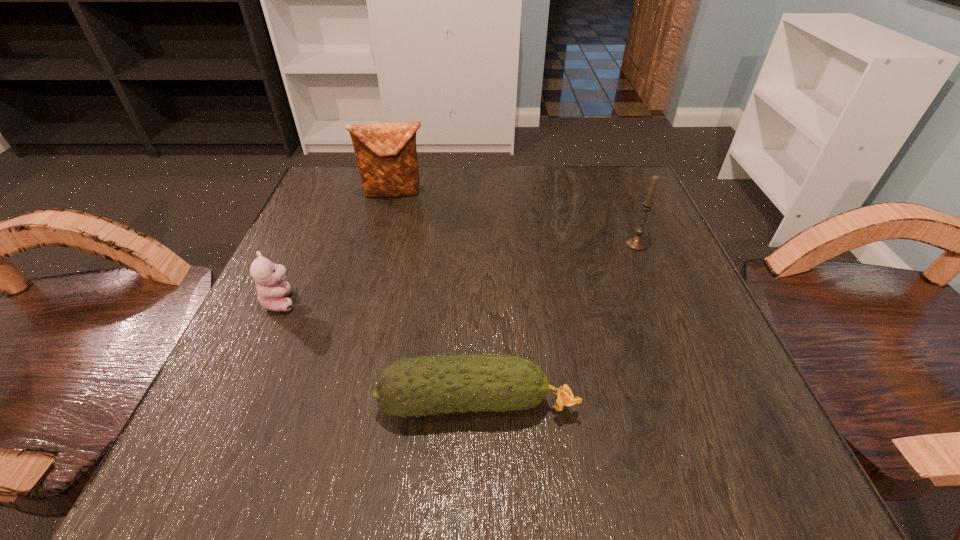
Image resolution: width=960 pixels, height=540 pixels. Find the location of `free space at the right edge`. free space at the right edge is located at coordinates (637, 310).

This screenshot has width=960, height=540. In the image, there is a desktop. What are the coordinates of `free region at the near left corner` in the screenshot? It's located at (306, 474).

The width and height of the screenshot is (960, 540). Find the location of `free spot at the far right corner of the desktop`. free spot at the far right corner of the desktop is located at coordinates (582, 171).

The image size is (960, 540). In order to click on free region at the near right corner of the desktop in this screenshot , I will do `click(735, 470)`.

Locate an element on the screen. The height and width of the screenshot is (540, 960). free space between the clutch bag and the third farthest object is located at coordinates (x=338, y=247).

The width and height of the screenshot is (960, 540). What are the coordinates of `free space between the third farthest object and the nearest object` in the screenshot? It's located at (379, 352).

Where is `vacant space that's between the candle and the shortest object`? This screenshot has width=960, height=540. vacant space that's between the candle and the shortest object is located at coordinates (557, 323).

Locate an element on the screen. This screenshot has height=540, width=960. unoccupied position between the rightmost object and the third farthest object is located at coordinates (459, 272).

The image size is (960, 540). What are the coordinates of `vacant area that lies between the third tallest object and the candle` in the screenshot? It's located at (459, 272).

This screenshot has width=960, height=540. In order to click on free spot between the candle and the clutch bag in this screenshot , I will do `click(516, 218)`.